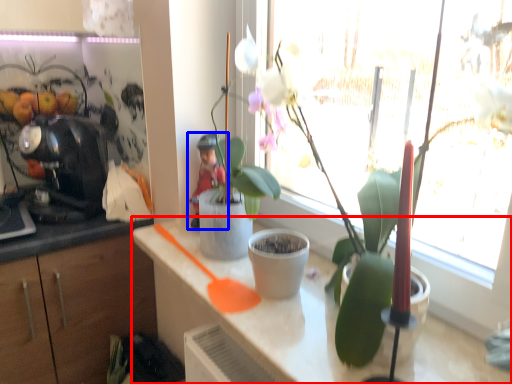
Question: Among these objects, which one is farthest to the camera, countertop (highlighted by a red box) or person (highlighted by a blue box)?

Choices:
 (A) countertop
 (B) person

Answer: (B)